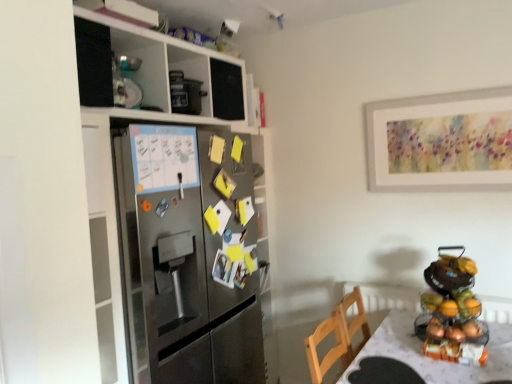
Question: From the image's perspective, is metallic fruit stand at right beneath stainless steel refrigerator at left?

Choices:
 (A) yes
 (B) no

Answer: (A)

Question: Is metallic fruit stand at right far from stainless steel refrigerator at left?

Choices:
 (A) yes
 (B) no

Answer: (A)

Question: Is metallic fruit stand at right to the left of stainless steel refrigerator at left from the viewer's perspective?

Choices:
 (A) no
 (B) yes

Answer: (A)

Question: From the image's perspective, is metallic fruit stand at right located above stainless steel refrigerator at left?

Choices:
 (A) yes
 (B) no

Answer: (B)

Question: Does metallic fruit stand at right appear on the right side of stainless steel refrigerator at left?

Choices:
 (A) yes
 (B) no

Answer: (A)

Question: Is point (134, 147) closer or farther from the camera than point (448, 365)?

Choices:
 (A) farther
 (B) closer

Answer: (B)

Question: In the image, is stainless steel refrigerator at left on the left side or the right side of white textured table at lower right?

Choices:
 (A) right
 (B) left

Answer: (B)

Question: From their relative heights in the image, would you say stainless steel refrigerator at left is taller or shorter than white textured table at lower right?

Choices:
 (A) short
 (B) tall

Answer: (B)

Question: Choose the correct answer: Is stainless steel refrigerator at left inside white textured table at lower right or outside it?

Choices:
 (A) inside
 (B) outside

Answer: (B)

Question: Considering the relative positions of white textured table at lower right and shiny metallic fruit basket at right in the image provided, is white textured table at lower right to the left or to the right of shiny metallic fruit basket at right?

Choices:
 (A) right
 (B) left

Answer: (B)

Question: Based on their sizes in the image, would you say white textured table at lower right is bigger or smaller than shiny metallic fruit basket at right?

Choices:
 (A) big
 (B) small

Answer: (A)

Question: From the image's perspective, is white textured table at lower right positioned above or below shiny metallic fruit basket at right?

Choices:
 (A) below
 (B) above

Answer: (A)

Question: From a real-world perspective, is white textured table at lower right above or below shiny metallic fruit basket at right?

Choices:
 (A) above
 (B) below

Answer: (B)

Question: Is metallic fruit stand at right situated inside stainless steel refrigerator at left or outside?

Choices:
 (A) outside
 (B) inside

Answer: (A)

Question: Is metallic fruit stand at right bigger or smaller than stainless steel refrigerator at left?

Choices:
 (A) small
 (B) big

Answer: (A)